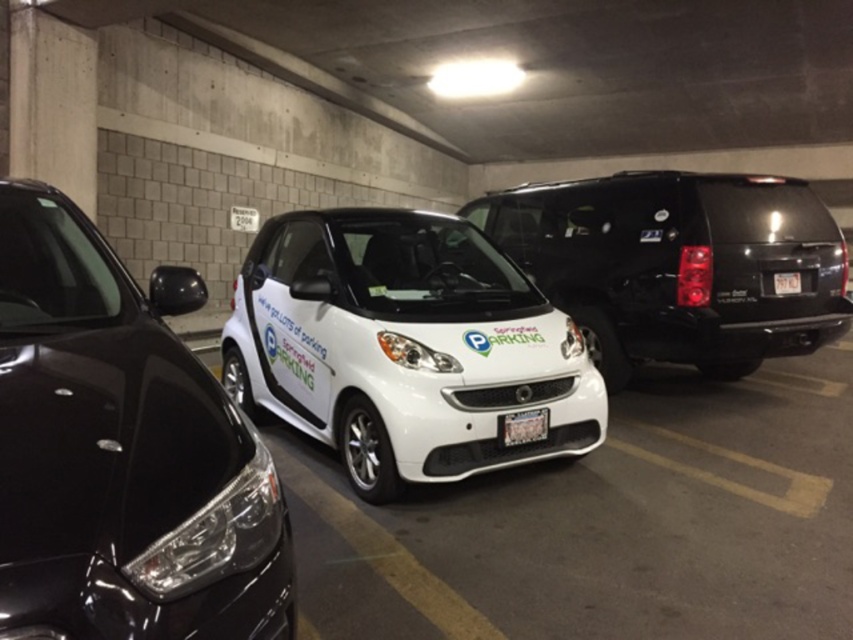
Does white glossy smart car at center have a lesser width compared to metallic silver license plate at center?

No, white glossy smart car at center is not thinner than metallic silver license plate at center.

Does white glossy smart car at center have a lesser height compared to metallic silver license plate at center?

No.

Between point (378, 355) and point (509, 426), which one is positioned behind?

The point (378, 355) is more distant.

This screenshot has width=853, height=640. I want to click on white glossy smart car at center, so click(x=404, y=346).

Does shiny black minivan at center lie in front of metallic silver license plate at center?

No, shiny black minivan at center is further to the viewer.

Between shiny black minivan at center and metallic silver license plate at center, which one has less height?

Standing shorter between the two is metallic silver license plate at center.

This screenshot has height=640, width=853. In order to click on shiny black minivan at center in this screenshot , I will do `click(677, 266)`.

Where is `shiny black minivan at center`? shiny black minivan at center is located at coordinates coord(677,266).

Is shiny black minivan at center positioned at the back of white plastic license plate at center?

No, it is not.

Between shiny black minivan at center and white plastic license plate at center, which one appears on the right side from the viewer's perspective?

Positioned to the right is white plastic license plate at center.

Is point (761, 227) closer to camera compared to point (793, 285)?

Yes, point (761, 227) is closer to viewer.

I want to click on shiny black minivan at center, so click(677, 266).